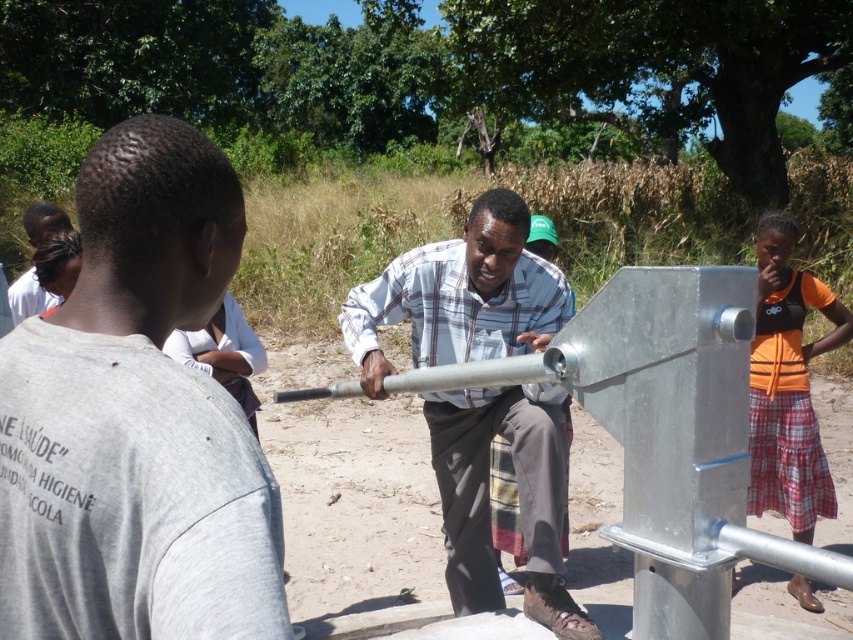
Question: Which is nearer to the metallic silver pipe at center?

Choices:
 (A) orange fabric skirt at lower right
 (B) dark brown hair at upper left

Answer: (A)

Question: Where is orange fabric skirt at lower right located in relation to dark brown hair at upper left in the image?

Choices:
 (A) above
 (B) below

Answer: (B)

Question: Is metallic silver water pump at center to the left of metallic silver pipe at center from the viewer's perspective?

Choices:
 (A) no
 (B) yes

Answer: (B)

Question: Which is farther from the orange fabric skirt at lower right?

Choices:
 (A) dark brown hair at upper left
 (B) metallic silver pipe at center

Answer: (A)

Question: Is metallic silver water pump at center to the left of orange fabric skirt at lower right from the viewer's perspective?

Choices:
 (A) yes
 (B) no

Answer: (A)

Question: Which object is farther from the camera taking this photo?

Choices:
 (A) dark brown hair at upper left
 (B) orange fabric skirt at lower right
 (C) metallic silver pipe at center
 (D) metallic silver water pump at center

Answer: (B)